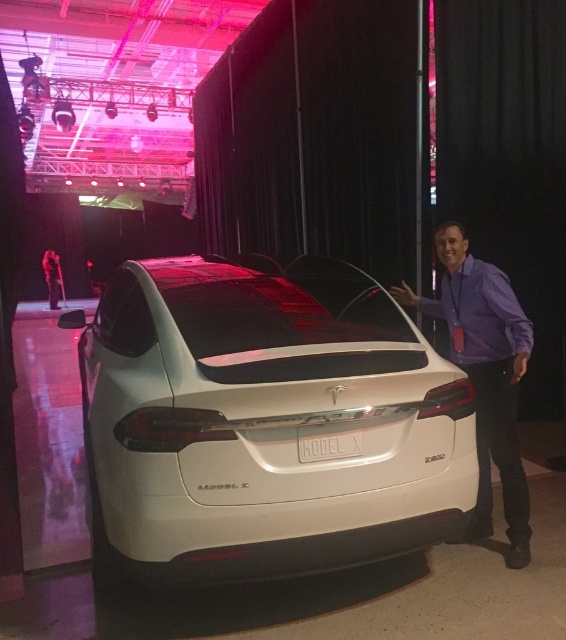
You are standing in front of the Tesla Model X display. If you want to locate the white glossy car at center, where should you look relative to the presenter?

The white glossy car at center is located at point (264,422), which means it is positioned to the left of the presenter standing to the right of the car.

You are attending a car exhibition and see the white glossy car at center and the purple shirt at right. Based on their positions, which one is closer to the front of the exhibition hall?

The white glossy car at center is closer to the front of the exhibition hall because it is positioned above the purple shirt at right, indicating it is nearer to the front area.